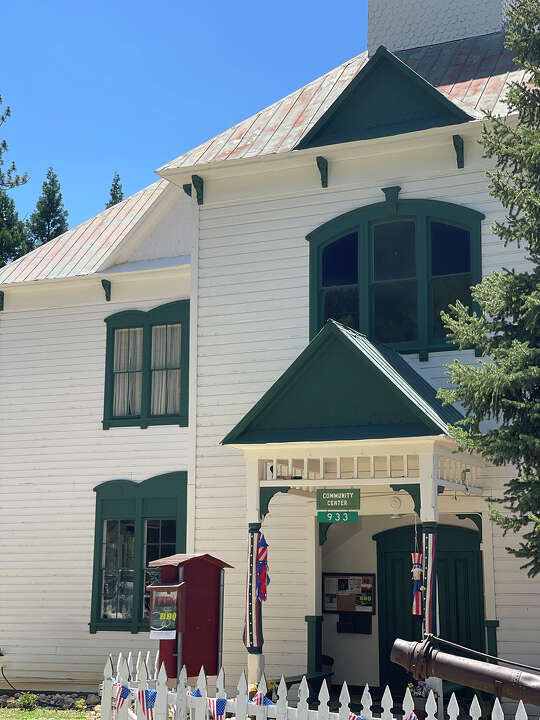
Locate an element on the screen. corbels is located at coordinates (322, 165), (107, 287), (458, 140), (199, 180), (2, 294).